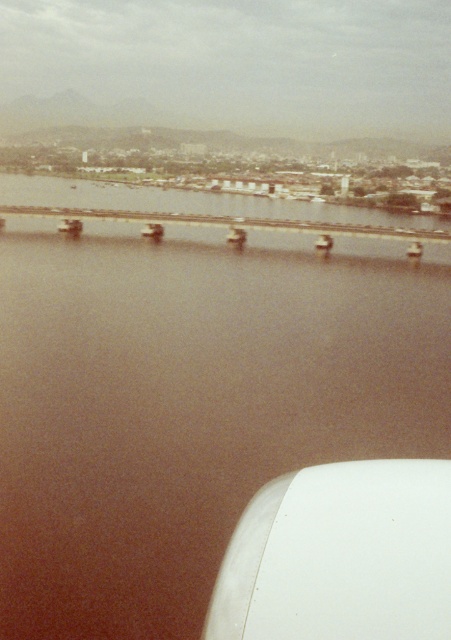
You are a pilot trying to navigate between the brown water at center and the concrete bridge at center. Which one is bigger in size?

The brown water at center has a larger size compared to the concrete bridge at center, so the brown water at center is bigger.

You are a passenger on the airplane and looking out the window. You see the brown water at center and the concrete bridge at center. Which one appears closer to you?

The brown water at center appears closer to you because it is closer to the viewer than the concrete bridge at center.